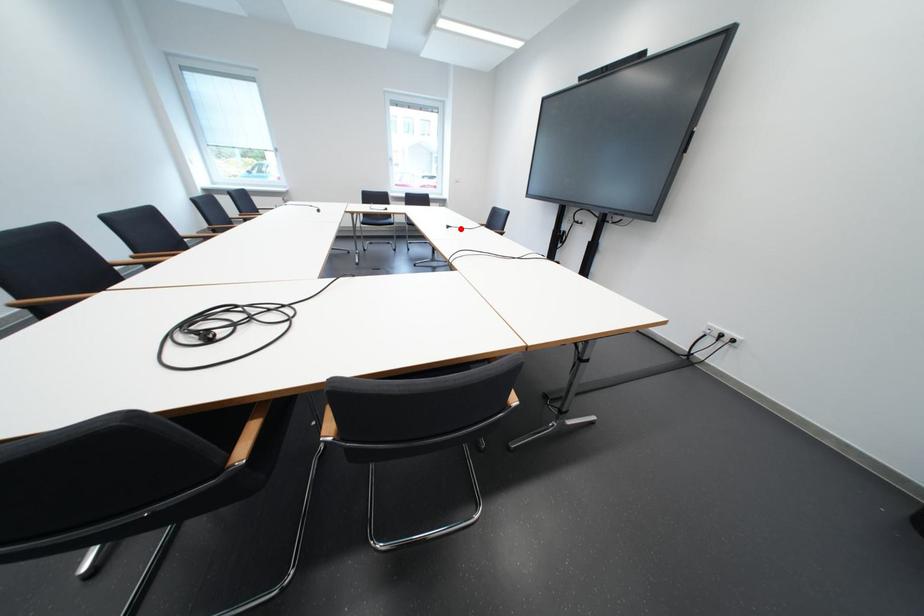
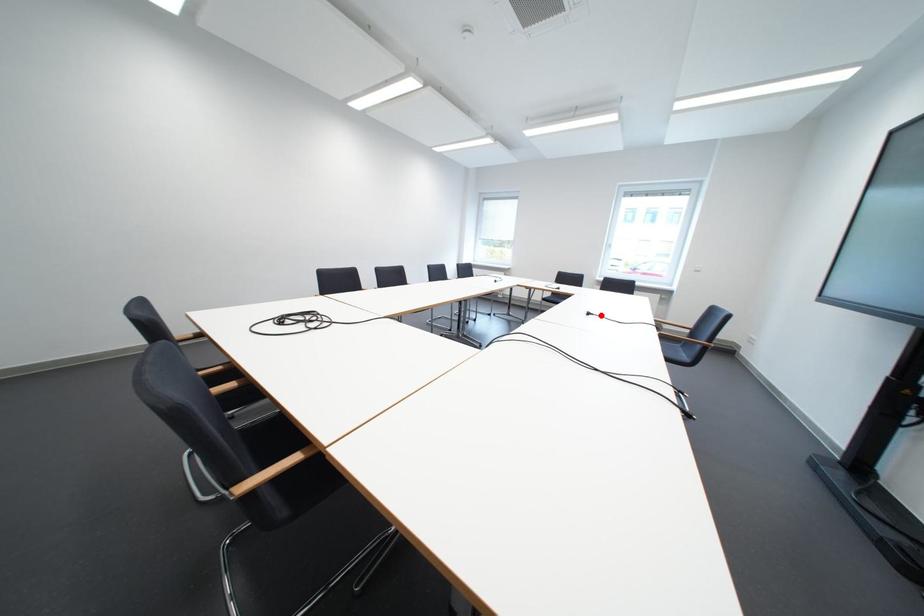
I am providing you with two images of the same scene from different viewpoints. A red point is marked on the first image and another point is marked on the second image. Do the highlighted points in image1 and image2 indicate the same real-world spot?

Yes